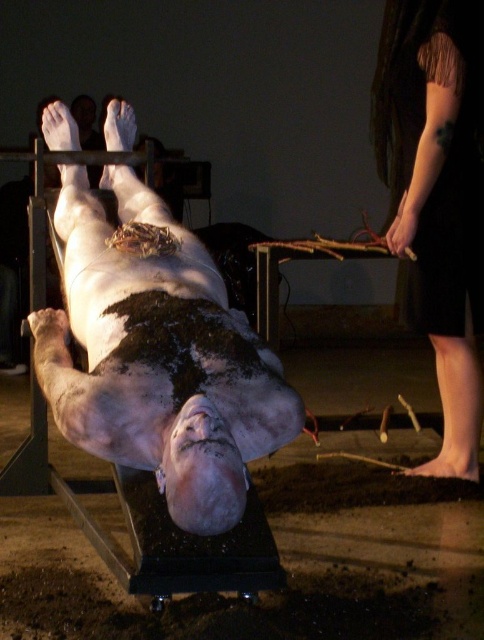
Question: Can you confirm if white matte human at center is bigger than dark fabric dress at right?

Choices:
 (A) no
 (B) yes

Answer: (B)

Question: Observing the image, what is the correct spatial positioning of white matte human at center in reference to dark fabric dress at right?

Choices:
 (A) below
 (B) above

Answer: (A)

Question: Is white matte human at center positioned before dark fabric dress at right?

Choices:
 (A) yes
 (B) no

Answer: (A)

Question: Which point is closer to the camera taking this photo?

Choices:
 (A) (401, 244)
 (B) (71, 241)

Answer: (B)

Question: Among these points, which one is nearest to the camera?

Choices:
 (A) (84, 256)
 (B) (464, 252)

Answer: (A)